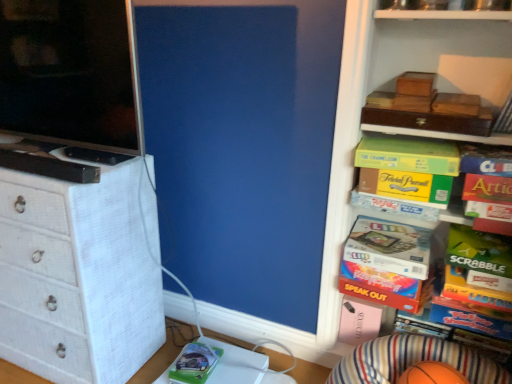
Identify the location of empty space that is ontop of white glossy computer desk at lower center (from a real-world perspective). Image resolution: width=512 pixels, height=384 pixels. 221,365.